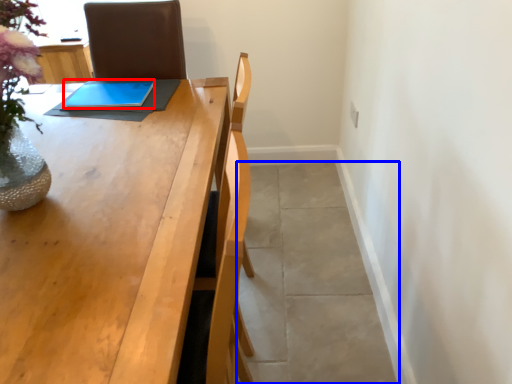
Question: Which object appears farthest to the camera in this image, tablet computer (highlighted by a red box) or concrete (highlighted by a blue box)?

Choices:
 (A) tablet computer
 (B) concrete

Answer: (A)